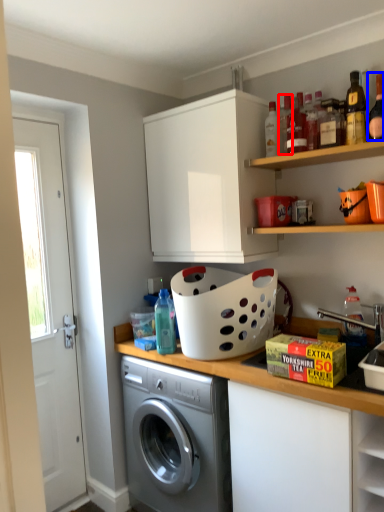
Question: Which object appears closest to the camera in this image, bottle (highlighted by a red box) or bottle (highlighted by a blue box)?

Choices:
 (A) bottle
 (B) bottle

Answer: (B)